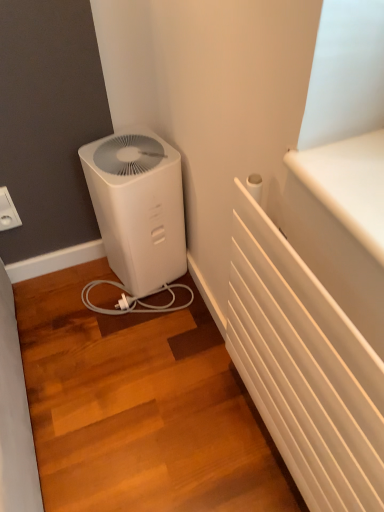
Question: From the image's perspective, is white plastic air purifier at lower left located above or below white plastic electric outlet at upper left?

Choices:
 (A) above
 (B) below

Answer: (B)

Question: Is white plastic air purifier at lower left spatially inside white plastic electric outlet at upper left, or outside of it?

Choices:
 (A) outside
 (B) inside

Answer: (A)

Question: Relative to white plastic electric outlet at upper left, is white plastic air purifier at lower left in front or behind?

Choices:
 (A) behind
 (B) front

Answer: (B)

Question: Is point (3, 202) closer or farther from the camera than point (152, 133)?

Choices:
 (A) farther
 (B) closer

Answer: (B)

Question: Looking at their shapes, would you say white plastic electric outlet at upper left is wider or thinner than white plastic air purifier at lower left?

Choices:
 (A) thin
 (B) wide

Answer: (A)

Question: Based on their sizes in the image, would you say white plastic electric outlet at upper left is bigger or smaller than white plastic air purifier at lower left?

Choices:
 (A) big
 (B) small

Answer: (B)

Question: Is white plastic electric outlet at upper left inside or outside of white plastic air purifier at lower left?

Choices:
 (A) outside
 (B) inside

Answer: (A)